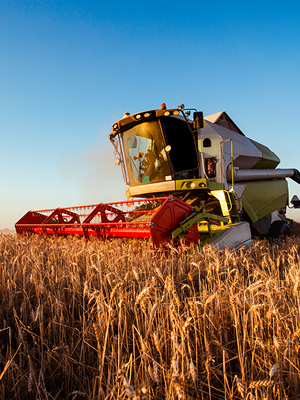
Locate an element on the screen. The image size is (300, 400). handles is located at coordinates (230, 203).